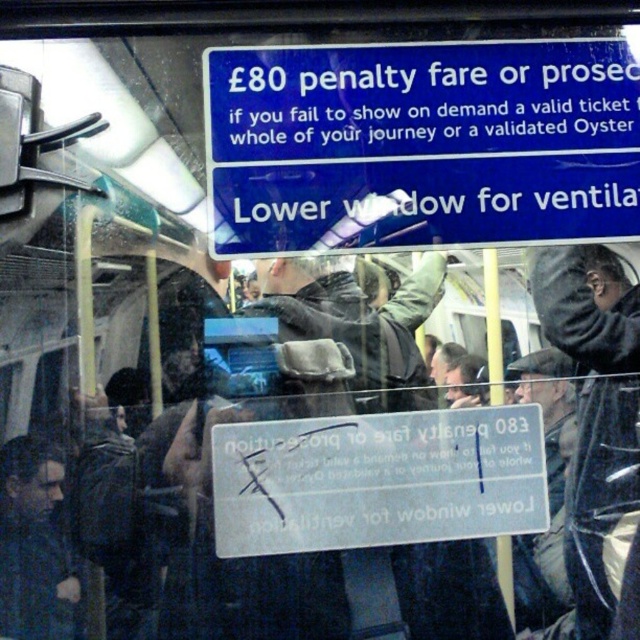
Question: Among these points, which one is nearest to the camera?

Choices:
 (A) [540, 502]
 (B) [291, 198]

Answer: (A)

Question: Is blue plastic sign at upper center closer to the viewer compared to white plastic sign at center?

Choices:
 (A) no
 (B) yes

Answer: (B)

Question: Does blue plastic sign at upper center have a greater width compared to white plastic sign at center?

Choices:
 (A) no
 (B) yes

Answer: (B)

Question: From the image, what is the correct spatial relationship of blue plastic sign at upper center in relation to white plastic sign at center?

Choices:
 (A) right
 (B) left

Answer: (A)